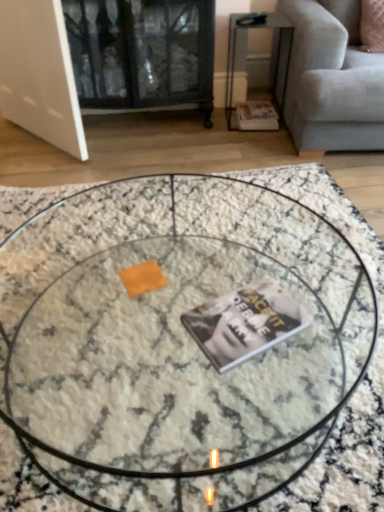
I want to click on vacant space situated on the left part of hardcover book at center, the 1th magazine from the left, so click(x=155, y=336).